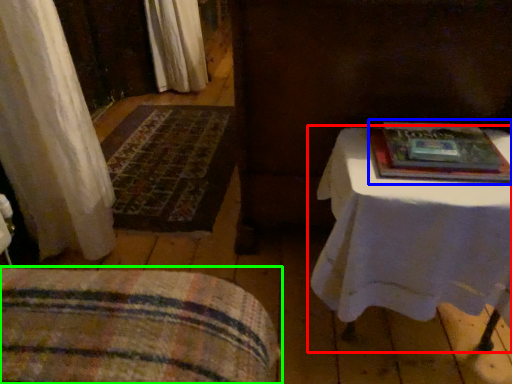
Question: Which object is positioned farthest from table (highlighted by a red box)? Select from paperback book (highlighted by a blue box) and furniture (highlighted by a green box).

Choices:
 (A) paperback book
 (B) furniture

Answer: (B)